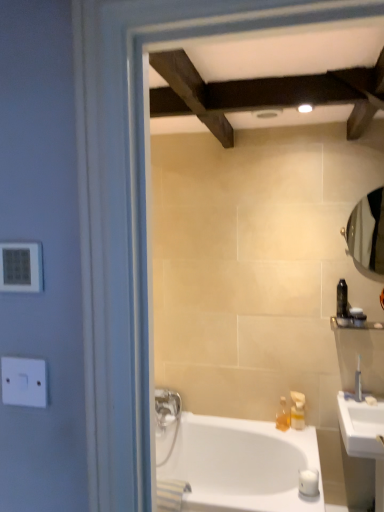
Question: Is clear glass mirror at right to the left or to the right of translucent plastic soap dispenser at right, which ranks as the 1th toiletry in left-to-right order, in the image?

Choices:
 (A) left
 (B) right

Answer: (B)

Question: Is clear glass mirror at right taller or shorter than translucent plastic soap dispenser at right, which is counted as the first toiletry, starting from the bottom?

Choices:
 (A) tall
 (B) short

Answer: (A)

Question: Estimate the real-world distances between objects in this image. Which object is closer to the translucent plastic soap dispenser at right, which ranks as the 1th toiletry in left-to-right order?

Choices:
 (A) white plastic electric outlet at left, which is the 2th electric outlet in bottom-to-top order
 (B) black glossy bottle at upper right, the 1th toiletry from the top
 (C) white glossy bathtub at lower center
 (D) translucent plastic soap dispenser at lower right
 (E) satin nickel faucet at right

Answer: (D)

Question: Estimate the real-world distances between objects in this image. Which object is farther from the white glossy bathtub at lower center?

Choices:
 (A) clear glass mirror at right
 (B) translucent plastic soap dispenser at right, arranged as the third toiletry when viewed from the left
 (C) black glossy bottle at upper right, the 2th toiletry in the left-to-right sequence
 (D) satin nickel faucet at right
 (E) white ceramic sink at lower right

Answer: (A)